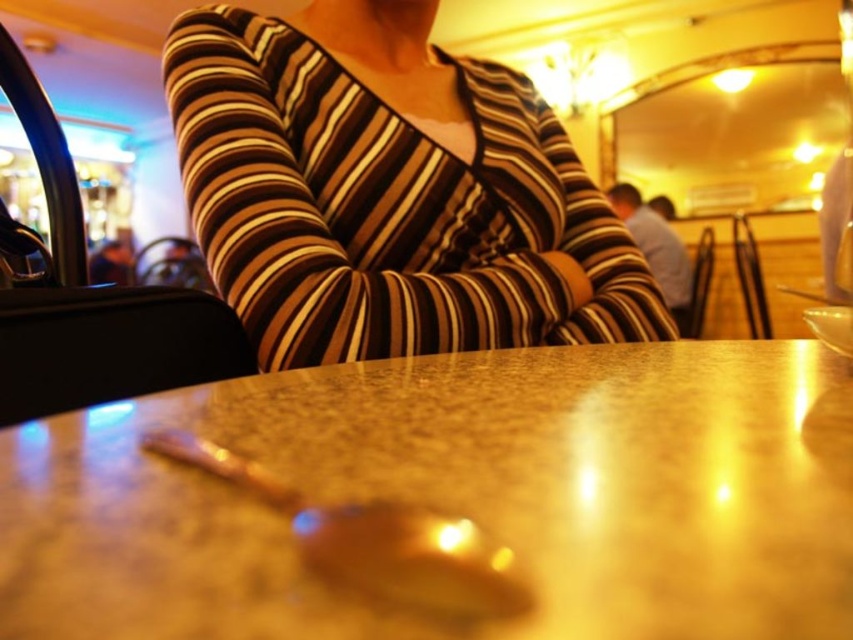
Can you confirm if striped jersey at center is wider than shiny metallic spoon at center?

Yes.

Who is shorter, striped jersey at center or shiny metallic spoon at center?

With less height is shiny metallic spoon at center.

Which is in front, point (228, 253) or point (448, 570)?

Point (448, 570) is in front.

Find the location of a particular element. Image resolution: width=853 pixels, height=640 pixels. striped jersey at center is located at coordinates (389, 192).

The image size is (853, 640). What are the coordinates of `marble table at center` in the screenshot? It's located at (457, 496).

Is marble table at center smaller than shiny metallic spoon at center?

Incorrect, marble table at center is not smaller in size than shiny metallic spoon at center.

Describe the element at coordinates (457, 496) in the screenshot. I see `marble table at center` at that location.

The height and width of the screenshot is (640, 853). In order to click on marble table at center in this screenshot , I will do `click(457, 496)`.

Is marble table at center bigger than striped jersey at center?

No, marble table at center is not bigger than striped jersey at center.

What do you see at coordinates (457, 496) in the screenshot? The image size is (853, 640). I see `marble table at center` at bounding box center [457, 496].

This screenshot has width=853, height=640. Describe the element at coordinates (457, 496) in the screenshot. I see `marble table at center` at that location.

At what (x,y) coordinates should I click in order to perform the action: click on marble table at center. Please return your answer as a coordinate pair (x, y). The height and width of the screenshot is (640, 853). Looking at the image, I should click on (457, 496).